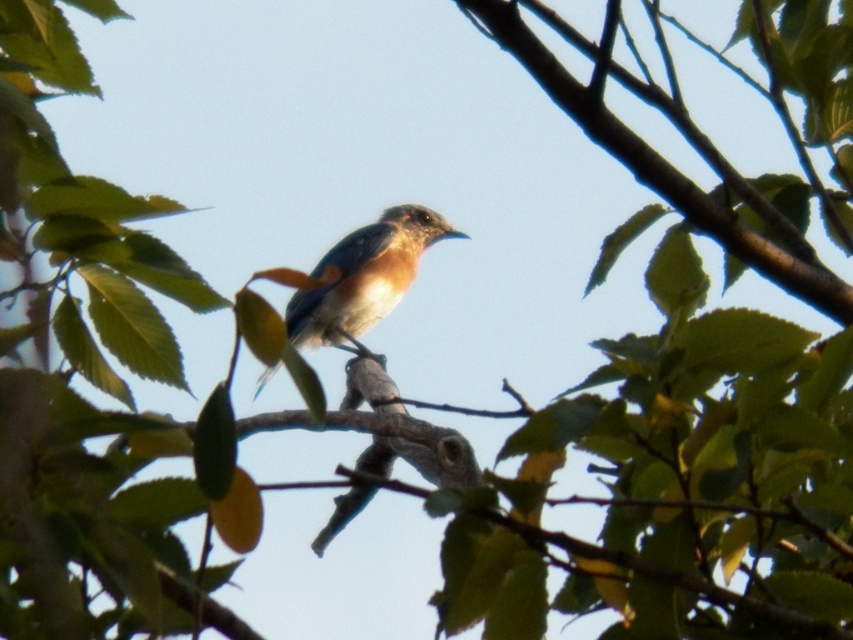
You are a birdwatcher trying to identify the species of the blue glossy bird at center. You notice it is perched on the brown wood tree branch at center. Based on the size comparison between the two, can you determine if the bird is larger or smaller than the branch?

The brown wood tree branch at center is thinner than the blue glossy bird at center, so the blue glossy bird at center is larger in width than the branch.

You are an ornithologist observing the brown wood tree branch at center and the blue glossy bird at center. Which object has a greater length?

The blue glossy bird at center is longer than the brown wood tree branch at center.